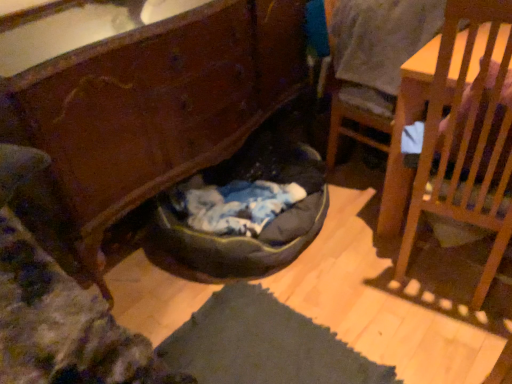
Question: From a real-world perspective, is wooden chair at right, the first chair in the right-to-left sequence, physically below dark gray fabric bean bag at lower center?

Choices:
 (A) no
 (B) yes

Answer: (A)

Question: Is wooden chair at right, the first chair in the right-to-left sequence, further to camera compared to dark gray fabric bean bag at lower center?

Choices:
 (A) no
 (B) yes

Answer: (A)

Question: Is there a large distance between wooden chair at right, placed as the second chair when sorted from left to right, and dark gray fabric bean bag at lower center?

Choices:
 (A) no
 (B) yes

Answer: (A)

Question: From a real-world perspective, is wooden chair at right, the first chair in the right-to-left sequence, on dark gray fabric bean bag at lower center?

Choices:
 (A) no
 (B) yes

Answer: (B)

Question: Is the surface of wooden chair at right, placed as the second chair when sorted from left to right, in direct contact with dark gray fabric bean bag at lower center?

Choices:
 (A) no
 (B) yes

Answer: (A)

Question: Considering the positions of white cotton shirt at upper right and wooden chair at right, placed as the second chair when sorted from left to right, in the image, is white cotton shirt at upper right bigger or smaller than wooden chair at right, placed as the second chair when sorted from left to right,?

Choices:
 (A) big
 (B) small

Answer: (B)

Question: Is white cotton shirt at upper right inside the boundaries of wooden chair at right, the first chair in the right-to-left sequence, or outside?

Choices:
 (A) inside
 (B) outside

Answer: (B)

Question: Based on their positions, is white cotton shirt at upper right located to the left or right of wooden chair at right, the first chair in the right-to-left sequence?

Choices:
 (A) left
 (B) right

Answer: (A)

Question: Does point (337, 52) appear closer or farther from the camera than point (408, 254)?

Choices:
 (A) closer
 (B) farther

Answer: (B)

Question: Considering their positions, is dark gray fabric bean bag at lower center located in front of or behind wooden chair at right, placed as the second chair when sorted from left to right?

Choices:
 (A) front
 (B) behind

Answer: (B)

Question: Does point (321, 160) appear closer or farther from the camera than point (464, 96)?

Choices:
 (A) closer
 (B) farther

Answer: (B)

Question: Considering the positions of dark gray fabric bean bag at lower center and wooden chair at right, the first chair in the right-to-left sequence, in the image, is dark gray fabric bean bag at lower center wider or thinner than wooden chair at right, the first chair in the right-to-left sequence,?

Choices:
 (A) wide
 (B) thin

Answer: (A)

Question: From the image's perspective, is dark gray fabric bean bag at lower center positioned above or below wooden chair at right, the first chair in the right-to-left sequence?

Choices:
 (A) below
 (B) above

Answer: (A)

Question: Is dark gray fabric bean bag at lower center inside or outside of wooden cabinet at lower center?

Choices:
 (A) inside
 (B) outside

Answer: (A)

Question: Is point (308, 147) positioned closer to the camera than point (82, 109)?

Choices:
 (A) closer
 (B) farther

Answer: (B)